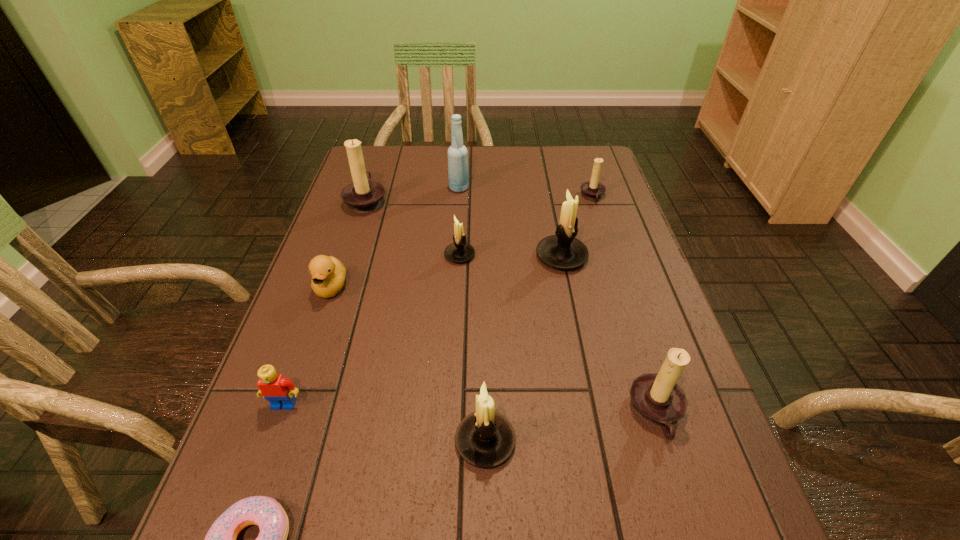
This screenshot has height=540, width=960. I want to click on free location that satisfies the following two spatial constraints: 1. on the wick of the leftmost candle holder; 2. on the face of the Lego, so coord(300,404).

In order to click on free location that satisfies the following two spatial constraints: 1. on the wick of the leftmost brown candle holder; 2. on the right side of the smallest white candle holder in this screenshot , I will do `click(348, 255)`.